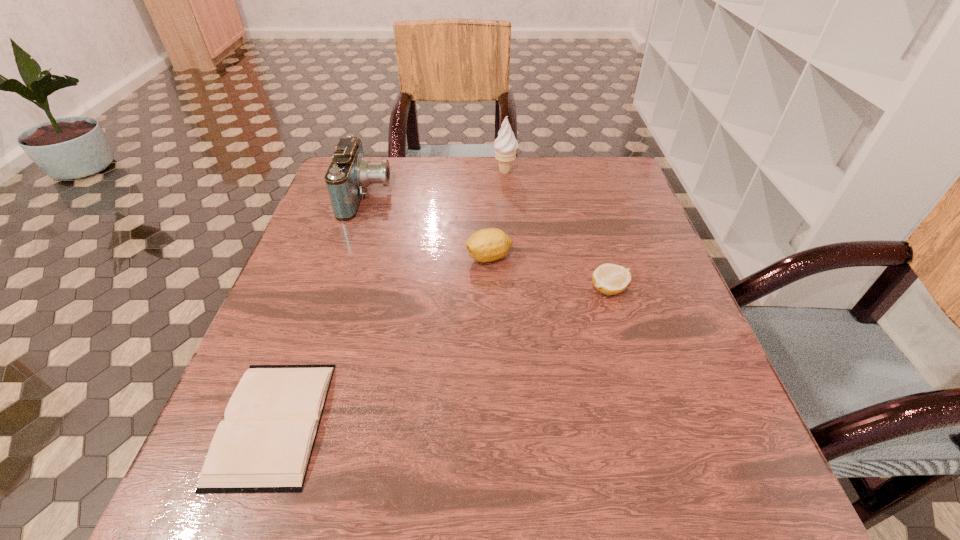
Find the location of a particular element. object at the right edge is located at coordinates (610, 279).

The width and height of the screenshot is (960, 540). I want to click on object that is at the far left corner, so click(x=349, y=174).

Locate an element on the screen. Image resolution: width=960 pixels, height=540 pixels. object present at the near left corner is located at coordinates coord(264,445).

Image resolution: width=960 pixels, height=540 pixels. In order to click on vacant space at the far edge in this screenshot , I will do `click(458, 169)`.

Where is `vacant space at the left edge`? This screenshot has width=960, height=540. vacant space at the left edge is located at coordinates (341, 276).

The image size is (960, 540). What are the coordinates of `free space at the right edge` in the screenshot? It's located at tap(692, 426).

Where is `vacant space at the far left corner of the desktop`? This screenshot has height=540, width=960. vacant space at the far left corner of the desktop is located at coordinates (327, 200).

Image resolution: width=960 pixels, height=540 pixels. I want to click on vacant space at the far right corner of the desktop, so click(x=612, y=174).

The width and height of the screenshot is (960, 540). I want to click on free area in between the rightmost object and the tallest object, so point(557,231).

Locate an element on the screen. free point between the icecream and the shortest object is located at coordinates (389, 297).